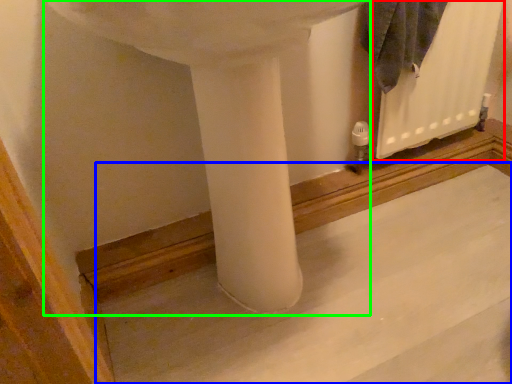
Question: Estimate the real-world distances between objects in this image. Which object is closer to radiator (highlighted by a red box), concrete (highlighted by a blue box) or sink (highlighted by a green box)?

Choices:
 (A) concrete
 (B) sink

Answer: (A)